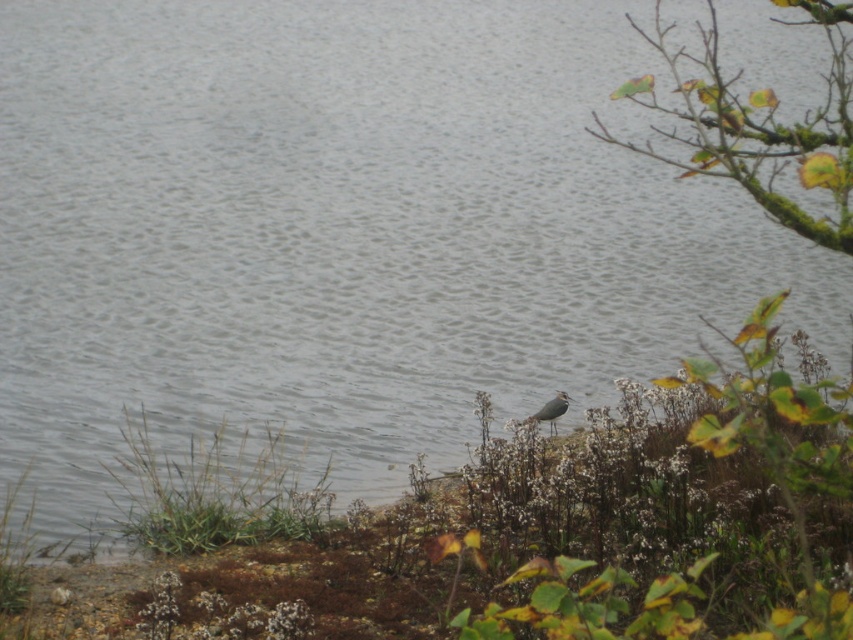
Is green mossy branch at upper right smaller than grayish-brown feathers at lower center?

No.

Consider the image. Which is more to the left, green mossy branch at upper right or grayish-brown feathers at lower center?

grayish-brown feathers at lower center

You are a GUI agent. You are given a task and a screenshot of the screen. Output one action in this format:
    pyautogui.click(x=<x>, y=<y>)
    Task: Click on the green mossy branch at upper right
    
    Given the screenshot: What is the action you would take?
    pyautogui.click(x=759, y=124)